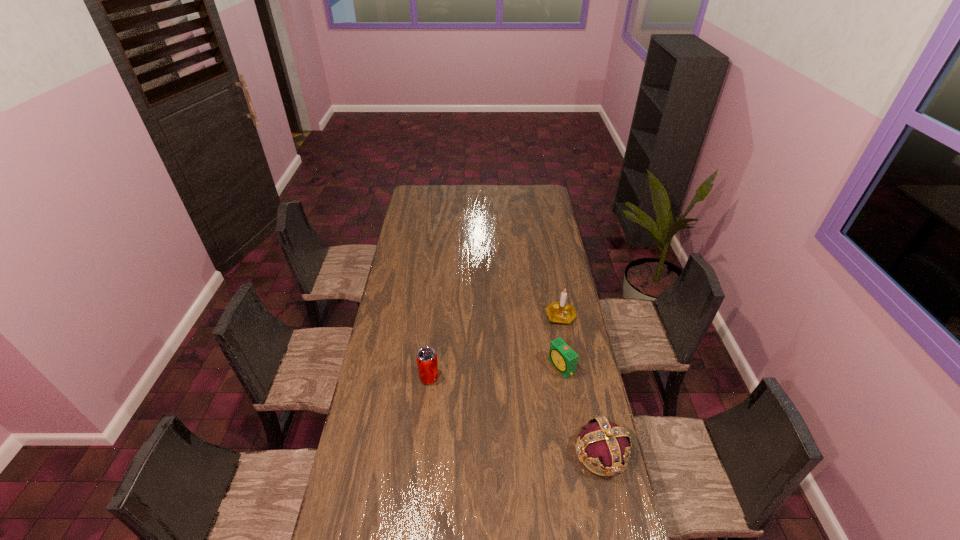
Locate an element on the screen. This screenshot has width=960, height=540. free space located with a handle on the farthest object is located at coordinates (539, 376).

Where is `vacant space located with a handle on the farthest object`? The image size is (960, 540). vacant space located with a handle on the farthest object is located at coordinates (533, 392).

The width and height of the screenshot is (960, 540). What are the coordinates of `crown at the right edge` in the screenshot? It's located at (605, 444).

This screenshot has width=960, height=540. Find the location of `alarm clock that is at the right edge`. alarm clock that is at the right edge is located at coordinates (561, 356).

At what (x,y) coordinates should I click in order to perform the action: click on candle holder that is positioned at the right edge. Please return your answer as a coordinate pair (x, y). Looking at the image, I should click on (561, 312).

In the image, there is a desktop. Identify the location of vacant space at the far edge. (525, 198).

Find the location of a particular element. The height and width of the screenshot is (540, 960). free space at the left edge is located at coordinates (411, 312).

In order to click on free space at the right edge in this screenshot , I will do `click(579, 423)`.

You are a GUI agent. You are given a task and a screenshot of the screen. Output one action in this format:
    pyautogui.click(x=<x>, y=<y>)
    Task: Click on the vacant space at the far left corner of the desktop
    The image size is (960, 540).
    Given the screenshot: What is the action you would take?
    pyautogui.click(x=408, y=201)

Image resolution: width=960 pixels, height=540 pixels. I want to click on blank area at the far right corner, so click(547, 199).